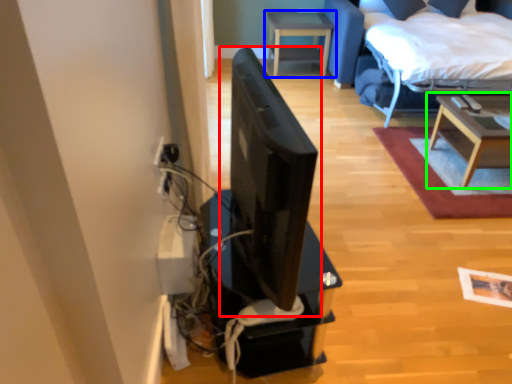
Question: Based on their relative distances, which object is farther from computer monitor (highlighted by a red box)? Choose from table (highlighted by a blue box) and table (highlighted by a green box).

Choices:
 (A) table
 (B) table

Answer: (A)